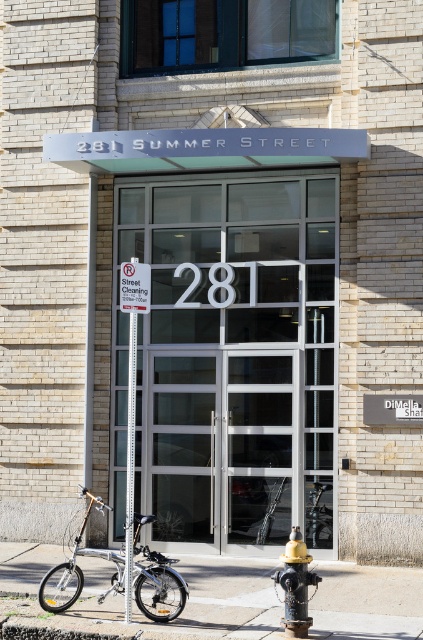
You are standing in front of the entrance to 281 Summer Street. You need to locate the transparent glass door at center. Where would you look?

The transparent glass door at center is located at point (230, 358).

You are standing at the entrance of 281 Summer Street and want to park your bicycle. Where should you place it so that it aligns with the existing silver metallic bicycle at lower left?

Place your bicycle at the coordinates point (156,580) where the silver metallic bicycle at lower left is located to align it.

You are a delivery person carrying a large package and need to enter the building at 281 Summer Street. You see the transparent glass door at center and the concrete sidewalk at lower center. Which object should you step onto to reach the entrance?

You should step onto the concrete sidewalk at lower center to reach the entrance, as the transparent glass door at center is located above it and likely requires approaching from the sidewalk.